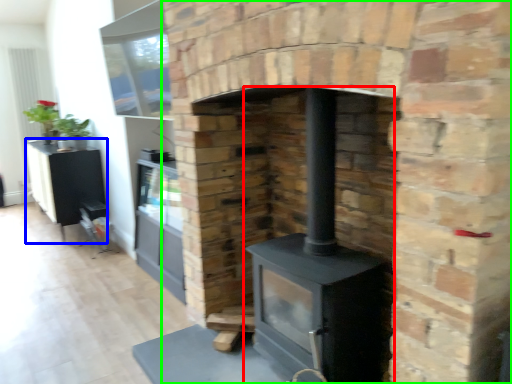
Question: Considering the real-world distances, which object is closest to wood burning stove (highlighted by a red box)? entertainment center (highlighted by a blue box) or fireplace (highlighted by a green box).

Choices:
 (A) entertainment center
 (B) fireplace

Answer: (B)